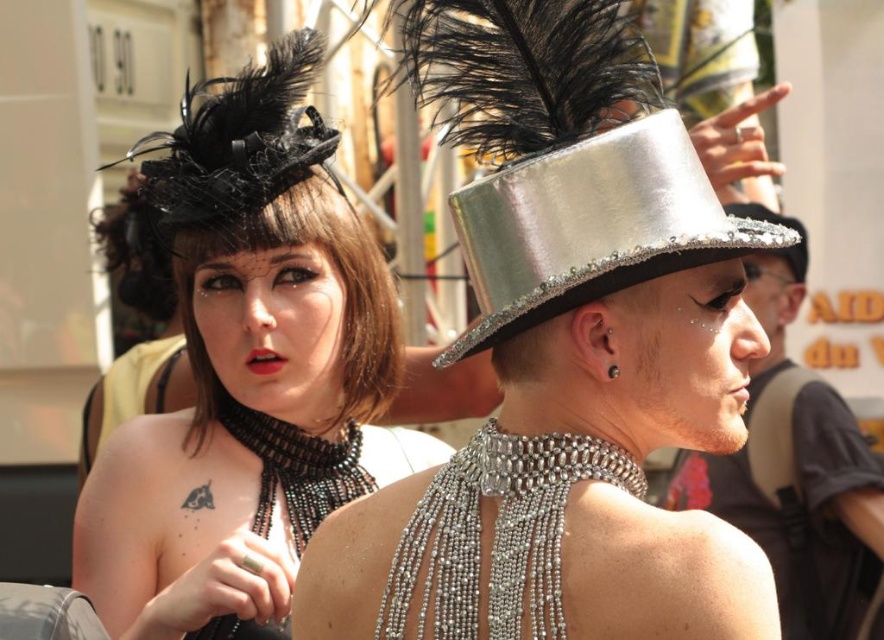
Question: Does shiny metallic hat at center have a lesser width compared to silver metallic hat at center?

Choices:
 (A) no
 (B) yes

Answer: (A)

Question: Which object appears closest to the camera in this image?

Choices:
 (A) shiny metallic hat at center
 (B) silver metallic hat at center

Answer: (A)

Question: From the image, what is the correct spatial relationship of matte black hat at upper left in relation to silver metallic hat at center?

Choices:
 (A) left
 (B) right

Answer: (A)

Question: Which point is farther to the camera?

Choices:
 (A) (545, 252)
 (B) (780, 257)
 (C) (298, 196)

Answer: (B)

Question: Which is nearer to the shiny silver hat at center?

Choices:
 (A) shiny metallic hat at center
 (B) matte black hat at upper left

Answer: (B)

Question: Does shiny metallic hat at center appear over silver metallic hat at center?

Choices:
 (A) no
 (B) yes

Answer: (A)